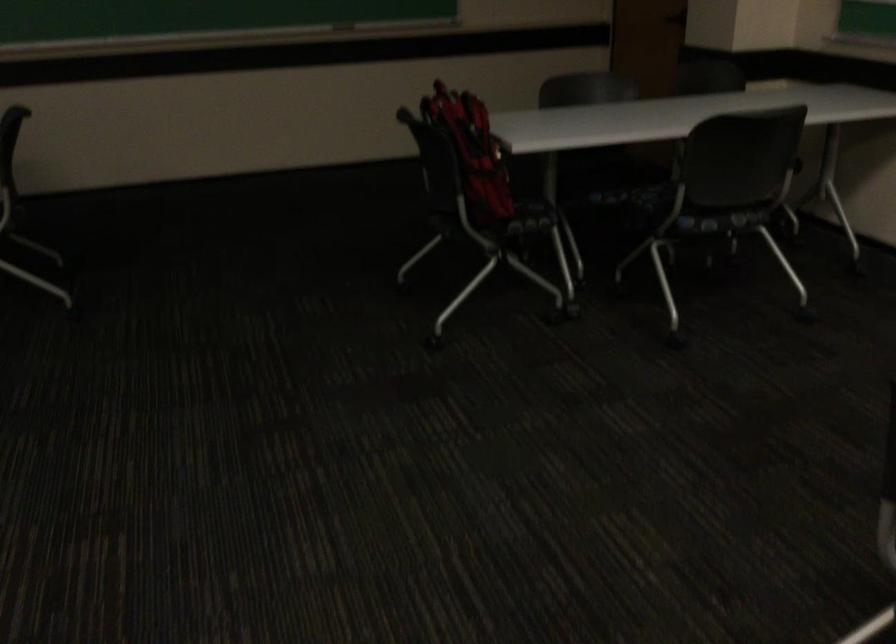
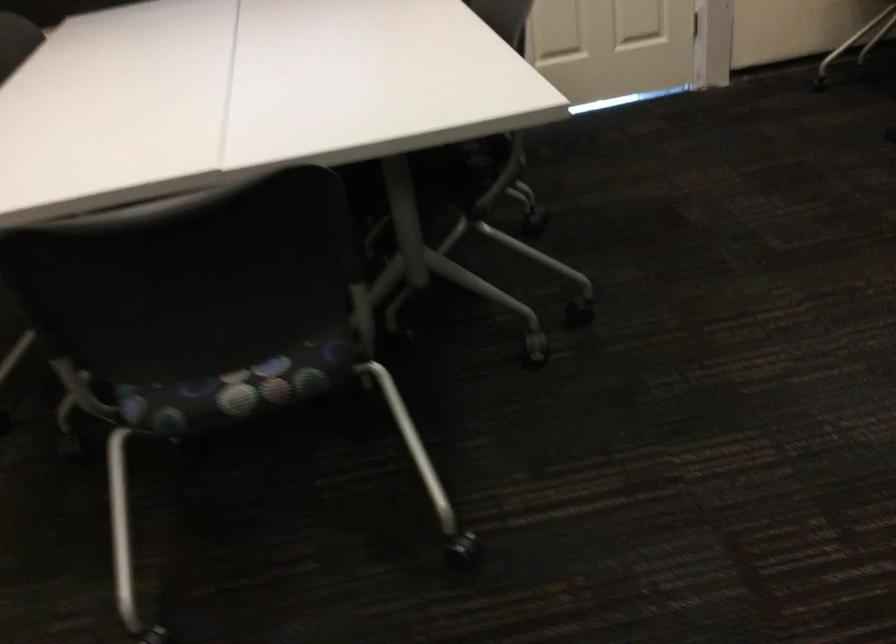
The first image is from the beginning of the video and the second image is from the end. How did the camera likely rotate when shooting the video?

The rotation direction of the camera is left-down.